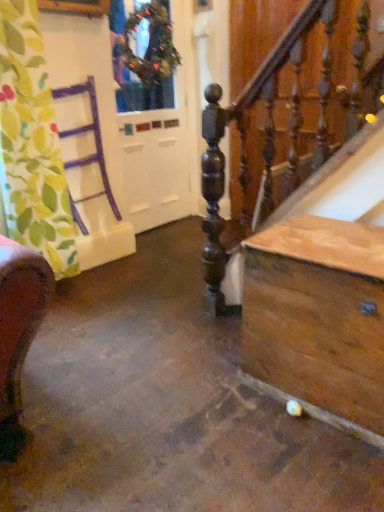
Question: Is white glossy door at upper left turned away from green textured wreath at upper center?

Choices:
 (A) no
 (B) yes

Answer: (B)

Question: Is white glossy door at upper left thinner than green textured wreath at upper center?

Choices:
 (A) yes
 (B) no

Answer: (A)

Question: Is green textured wreath at upper center inside white glossy door at upper left?

Choices:
 (A) no
 (B) yes

Answer: (A)

Question: From a real-world perspective, is white glossy door at upper left under green textured wreath at upper center?

Choices:
 (A) no
 (B) yes

Answer: (B)

Question: Considering the relative sizes of white glossy door at upper left and green textured wreath at upper center in the image provided, is white glossy door at upper left bigger than green textured wreath at upper center?

Choices:
 (A) yes
 (B) no

Answer: (A)

Question: From their relative heights in the image, would you say white glossy door at upper left is taller or shorter than green leafy fabric at left?

Choices:
 (A) short
 (B) tall

Answer: (B)

Question: From the image's perspective, is white glossy door at upper left above or below green leafy fabric at left?

Choices:
 (A) above
 (B) below

Answer: (A)

Question: Considering the positions of point (155, 133) and point (11, 98), is point (155, 133) closer or farther from the camera than point (11, 98)?

Choices:
 (A) farther
 (B) closer

Answer: (A)

Question: Considering their positions, is white glossy door at upper left located in front of or behind green leafy fabric at left?

Choices:
 (A) front
 (B) behind

Answer: (B)

Question: From the image's perspective, is white glossy door at upper left above or below green textured wreath at upper center?

Choices:
 (A) below
 (B) above

Answer: (A)

Question: Relative to green textured wreath at upper center, is white glossy door at upper left in front or behind?

Choices:
 (A) front
 (B) behind

Answer: (B)

Question: Considering the relative positions of white glossy door at upper left and green textured wreath at upper center in the image provided, is white glossy door at upper left to the left or to the right of green textured wreath at upper center?

Choices:
 (A) right
 (B) left

Answer: (B)

Question: Do you think white glossy door at upper left is within green textured wreath at upper center, or outside of it?

Choices:
 (A) inside
 (B) outside

Answer: (B)

Question: Considering the positions of wooden chest at lower right and white glossy door at upper left in the image, is wooden chest at lower right wider or thinner than white glossy door at upper left?

Choices:
 (A) thin
 (B) wide

Answer: (B)

Question: From the image's perspective, is wooden chest at lower right located above or below white glossy door at upper left?

Choices:
 (A) below
 (B) above

Answer: (A)